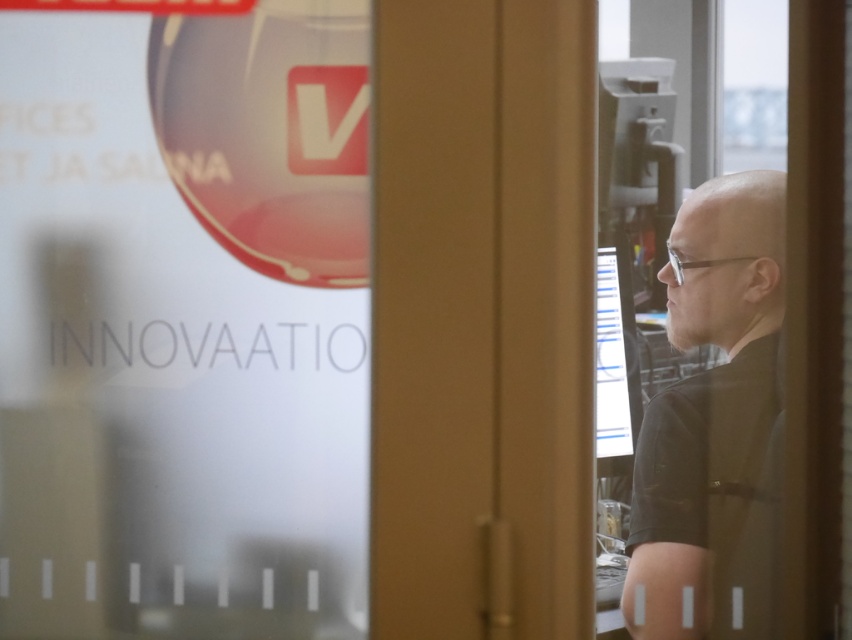
Question: Does black matte shirt at right appear over matte black monitor at center?

Choices:
 (A) yes
 (B) no

Answer: (B)

Question: Is black matte shirt at right wider than matte black monitor at center?

Choices:
 (A) yes
 (B) no

Answer: (A)

Question: Which object is closer to the camera taking this photo?

Choices:
 (A) black matte shirt at right
 (B) matte black monitor at center

Answer: (A)

Question: From the image, what is the correct spatial relationship of black matte shirt at right in relation to matte black monitor at center?

Choices:
 (A) right
 (B) left

Answer: (A)